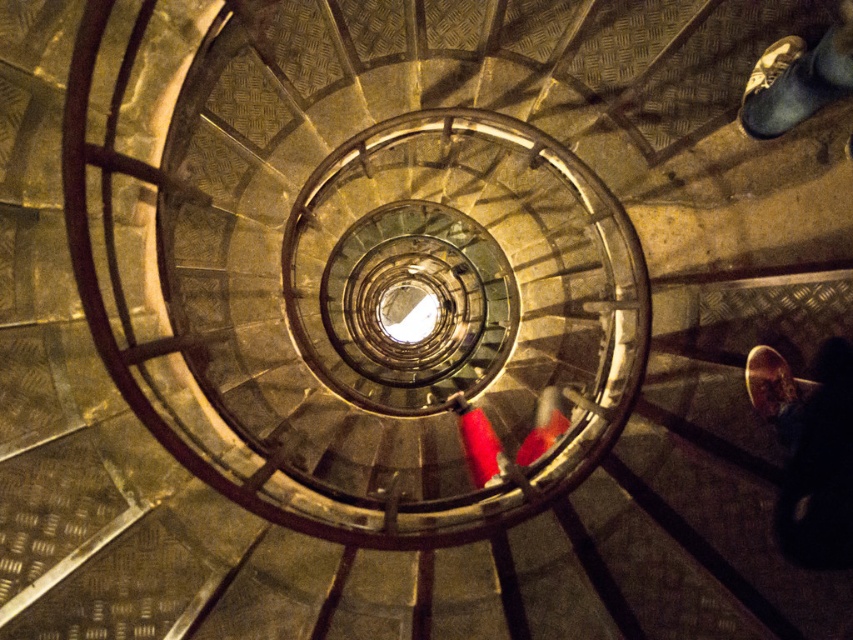
Does leather shoe at upper right have a lesser height compared to rubberized red shoes at center?

Correct, leather shoe at upper right is not as tall as rubberized red shoes at center.

Can you confirm if leather shoe at upper right is positioned above rubberized red shoes at center?

Correct, leather shoe at upper right is located above rubberized red shoes at center.

Does point (827, 52) come in front of point (567, 428)?

Yes, point (827, 52) is closer to viewer.

You are a GUI agent. You are given a task and a screenshot of the screen. Output one action in this format:
    pyautogui.click(x=<x>, y=<y>)
    Task: Click on the leather shoe at upper right
    
    Given the screenshot: What is the action you would take?
    pyautogui.click(x=798, y=77)

Who is more distant from viewer, (831, 451) or (548, 401)?

The point (548, 401) is more distant.

Is leather shoe at lower right positioned in front of rubberized red shoes at center?

Yes, leather shoe at lower right is closer to the viewer.

What do you see at coordinates (810, 452) in the screenshot?
I see `leather shoe at lower right` at bounding box center [810, 452].

Image resolution: width=853 pixels, height=640 pixels. Identify the location of leather shoe at lower right. (810, 452).

Who is lower down, leather shoe at lower right or leather shoe at upper right?

leather shoe at lower right

Locate an element on the screen. The height and width of the screenshot is (640, 853). leather shoe at lower right is located at coordinates (810, 452).

You are a GUI agent. You are given a task and a screenshot of the screen. Output one action in this format:
    pyautogui.click(x=<x>, y=<y>)
    Task: Click on the leather shoe at lower right
    
    Given the screenshot: What is the action you would take?
    pyautogui.click(x=810, y=452)